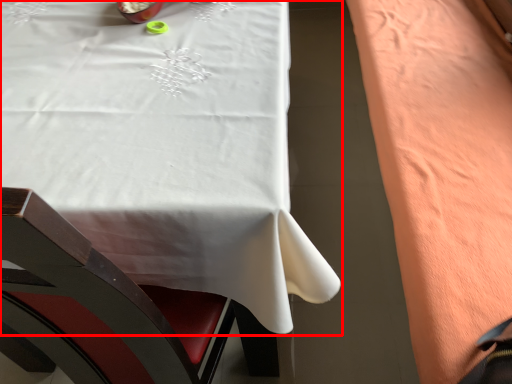
Question: From the image's perspective, what is the correct spatial relationship of table (annotated by the red box) in relation to blanket?

Choices:
 (A) below
 (B) above

Answer: (B)